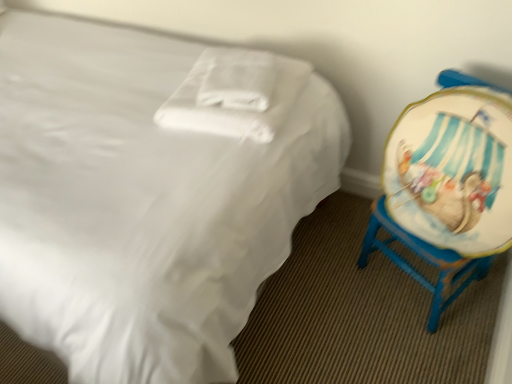
This screenshot has width=512, height=384. What do you see at coordinates (448, 185) in the screenshot?
I see `wooden painted chair at right` at bounding box center [448, 185].

The width and height of the screenshot is (512, 384). What are the coordinates of `white satin bed at center` in the screenshot? It's located at (147, 197).

The image size is (512, 384). In order to click on wooden painted chair at right in this screenshot , I will do `click(448, 185)`.

Is white satin bed at center thinner than white soft pillow at center?

In fact, white satin bed at center might be wider than white soft pillow at center.

In terms of size, does white satin bed at center appear bigger or smaller than white soft pillow at center?

In the image, white satin bed at center appears to be larger than white soft pillow at center.

From a real-world perspective, is white satin bed at center below white soft pillow at center?

Yes, from a real-world perspective, white satin bed at center is below white soft pillow at center.

From the image's perspective, which one is positioned lower, white satin bed at center or white soft pillow at center?

From the image's view, white satin bed at center is below.

Between point (157, 334) and point (471, 107), which one is positioned in front?

Point (157, 334)

Measure the distance from white satin bed at center to wooden painted chair at right.

22.07 inches.

Based on the photo, is white satin bed at center positioned with its back to wooden painted chair at right?

white satin bed at center does not have its back to wooden painted chair at right.

Can you confirm if white satin bed at center is wider than wooden painted chair at right?

Yes, white satin bed at center is wider than wooden painted chair at right.

From the image's perspective, which is above, wooden painted chair at right or white soft pillow at center?

white soft pillow at center.

Between wooden painted chair at right and white soft pillow at center, which one has larger width?

white soft pillow at center is wider.

Looking at this image, which is less distant, (479, 184) or (294, 59)?

Point (479, 184)

Is wooden painted chair at right further to camera compared to white soft pillow at center?

That is False.

Is white soft pillow at center turned away from wooden painted chair at right?

No, white soft pillow at center's orientation is not away from wooden painted chair at right.

How many degrees apart are the facing directions of white soft pillow at center and wooden painted chair at right?

The angular difference between white soft pillow at center and wooden painted chair at right is 129 degrees.

From the image's perspective, between white soft pillow at center and wooden painted chair at right, who is located below?

wooden painted chair at right appears lower in the image.

Between point (402, 132) and point (1, 210), which one is positioned behind?

The point (402, 132) is farther.

Considering the relative sizes of wooden painted chair at right and white satin bed at center in the image provided, is wooden painted chair at right taller than white satin bed at center?

In fact, wooden painted chair at right may be shorter than white satin bed at center.

Is there a large distance between wooden painted chair at right and white satin bed at center?

No.

Considering the relative sizes of white soft pillow at center and white satin bed at center in the image provided, is white soft pillow at center thinner than white satin bed at center?

Indeed, white soft pillow at center has a lesser width compared to white satin bed at center.

Identify the location of bed below the white soft pillow at center (from a real-world perspective). Image resolution: width=512 pixels, height=384 pixels. (147, 197).

Does white soft pillow at center appear on the right side of white satin bed at center?

Yes.

Locate an element on the screen. pillow on the right side of white satin bed at center is located at coordinates (234, 94).

In the image, there is a wooden painted chair at right. Find the location of `bed above it (from the image's perspective)`. bed above it (from the image's perspective) is located at coordinates (147, 197).

From the picture: Considering their positions, is white satin bed at center positioned closer to white soft pillow at center than wooden painted chair at right?

white satin bed at center is positioned closer to the anchor white soft pillow at center.

Looking at the image, which one is located further to white soft pillow at center, wooden painted chair at right or white satin bed at center?

wooden painted chair at right lies further to white soft pillow at center than the other object.

From the image, which object appears to be farther from white satin bed at center, wooden painted chair at right or white soft pillow at center?

The object further to white satin bed at center is wooden painted chair at right.

Considering their positions, is white soft pillow at center positioned further to wooden painted chair at right than white satin bed at center?

white satin bed at center is positioned further to the anchor wooden painted chair at right.

Looking at this image, considering their positions, is white satin bed at center positioned closer to wooden painted chair at right than white soft pillow at center?

white soft pillow at center is closer to wooden painted chair at right.

Considering their positions, is white soft pillow at center positioned further to white satin bed at center than wooden painted chair at right?

wooden painted chair at right is further to white satin bed at center.

Image resolution: width=512 pixels, height=384 pixels. Find the location of `pillow located between white satin bed at center and wooden painted chair at right in the left-right direction`. pillow located between white satin bed at center and wooden painted chair at right in the left-right direction is located at coordinates (234, 94).